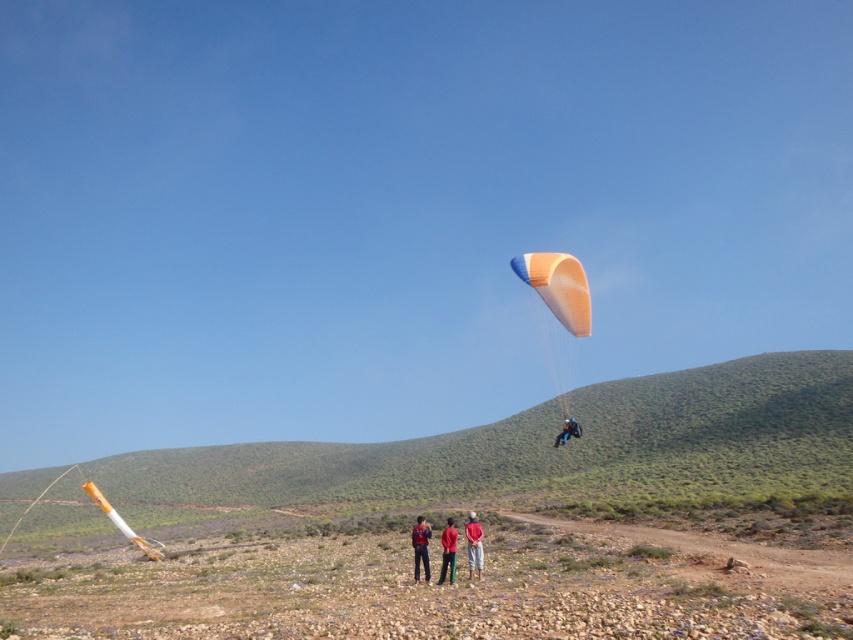
You are a photographer wanting to capture both the red cotton shirt at center and the red fabric jacket at center in the same frame. Which one should you focus on to ensure both are in the frame without moving the camera?

The red cotton shirt at center is smaller than the red fabric jacket at center, so focusing on the red fabric jacket at center would allow both to be captured in the frame since it is larger and might be more central.

You are an observer standing on the rocky terrain looking at the orange fabric parachute at center and the dark blue fabric parachute at upper center. Which parachute is higher in the sky?

The orange fabric parachute at center is taller than the dark blue fabric parachute at upper center, so the orange fabric parachute at center is higher in the sky.